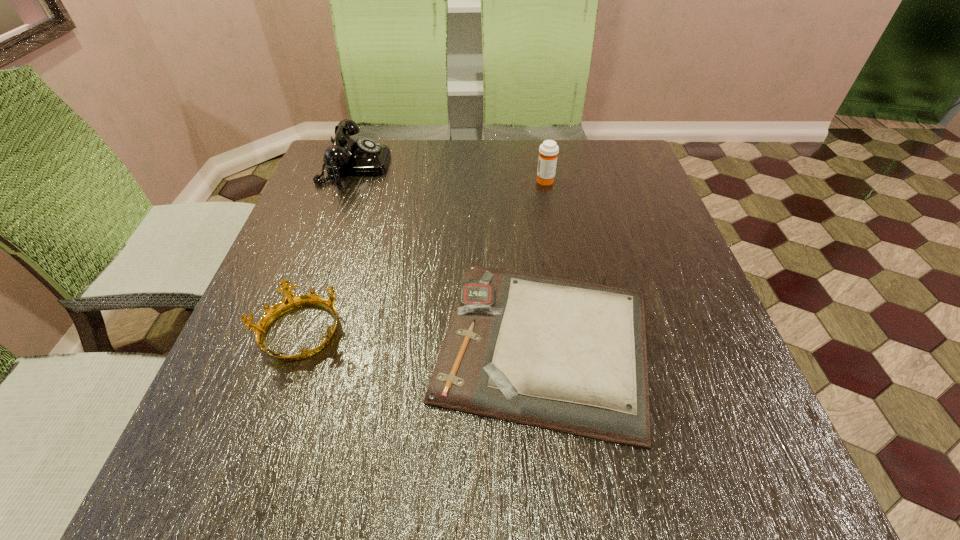
The height and width of the screenshot is (540, 960). I want to click on object present at the near edge, so click(570, 356).

Identify the location of telephone that is positioned at the left edge. (346, 157).

At what (x,y) coordinates should I click in order to perform the action: click on crown that is positioned at the left edge. Please return your answer as a coordinate pair (x, y). Looking at the image, I should click on (290, 301).

Where is `object located at the right edge`? object located at the right edge is located at coordinates (570, 356).

Where is `object located in the far left corner section of the desktop`? The height and width of the screenshot is (540, 960). object located in the far left corner section of the desktop is located at coordinates (346, 157).

At what (x,y) coordinates should I click in order to perform the action: click on object that is at the near right corner. Please return your answer as a coordinate pair (x, y). This screenshot has height=540, width=960. Looking at the image, I should click on pyautogui.click(x=570, y=356).

This screenshot has height=540, width=960. What are the coordinates of `vacant space at the far edge of the desktop` in the screenshot? It's located at (524, 171).

Locate an element on the screen. The image size is (960, 540). vacant space at the near edge of the desktop is located at coordinates (450, 472).

Locate an element on the screen. This screenshot has height=540, width=960. vacant region at the left edge is located at coordinates (239, 350).

In the image, there is a desktop. Identify the location of vacant space at the right edge. The height and width of the screenshot is (540, 960). (613, 218).